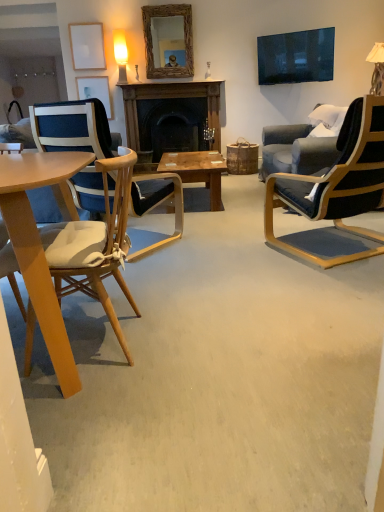
Where is `white fabric lampshade at upper right, the first lamp from the right`? white fabric lampshade at upper right, the first lamp from the right is located at coordinates (377, 68).

Locate an element on the screen. black leather chair at right, marked as the first chair in a right-to-left arrangement is located at coordinates (336, 192).

The image size is (384, 512). What do you see at coordinates (72, 127) in the screenshot?
I see `matte blue wood chair at left, arranged as the third chair when viewed from the right` at bounding box center [72, 127].

What is the approximate width of dark wood fireplace at center?

It is 8.84 inches.

The image size is (384, 512). What are the coordinates of `matte white picture frame at upper left, the second picture frame viewed from the top` in the screenshot? It's located at (95, 90).

How different are the orientations of dark wood fireplace at center and white matte picture frame at upper left, the first picture frame in the top-to-bottom sequence, in degrees?

There is a 0.0137-degree angle between the facing directions of dark wood fireplace at center and white matte picture frame at upper left, the first picture frame in the top-to-bottom sequence.

From the image's perspective, which is above, dark wood fireplace at center or white matte picture frame at upper left, the first picture frame in the top-to-bottom sequence?

white matte picture frame at upper left, the first picture frame in the top-to-bottom sequence, from the image's perspective.

Is dark wood fireplace at center far from white matte picture frame at upper left, the first picture frame in the top-to-bottom sequence?

That's right, there is a large distance between dark wood fireplace at center and white matte picture frame at upper left, the first picture frame in the top-to-bottom sequence.

Who is shorter, dark wood fireplace at center or white matte picture frame at upper left, the first picture frame in the top-to-bottom sequence?

white matte picture frame at upper left, the first picture frame in the top-to-bottom sequence, is shorter.

From the image's perspective, does dark wood fireplace at center appear lower than wooden coffee table at center?

No, from the image's perspective, dark wood fireplace at center is not beneath wooden coffee table at center.

From a real-world perspective, is dark wood fireplace at center positioned over wooden coffee table at center based on gravity?

Yes, from a real-world perspective, dark wood fireplace at center is on top of wooden coffee table at center.

Considering the points (209, 103) and (197, 167), which point is in front, point (209, 103) or point (197, 167)?

The point (197, 167) is closer to the camera.

Which object is positioned more to the right, dark wood fireplace at center or wooden coffee table at center?

From the viewer's perspective, wooden coffee table at center appears more on the right side.

From the picture: Can you confirm if white matte picture frame at upper left, which ranks as the 1th picture frame in front-to-back order, is thinner than white fabric lampshade at upper right, which is the second lamp from left to right?

Correct, the width of white matte picture frame at upper left, which ranks as the 1th picture frame in front-to-back order, is less than that of white fabric lampshade at upper right, which is the second lamp from left to right.

Is white matte picture frame at upper left, placed as the second picture frame when sorted from back to front, shorter than white fabric lampshade at upper right, the first lamp from the right?

Indeed, white matte picture frame at upper left, placed as the second picture frame when sorted from back to front, has a lesser height compared to white fabric lampshade at upper right, the first lamp from the right.

Would you consider white matte picture frame at upper left, which is the second picture frame from bottom to top, to be distant from white fabric lampshade at upper right, which is the second lamp from left to right?

Yes, white matte picture frame at upper left, which is the second picture frame from bottom to top, and white fabric lampshade at upper right, which is the second lamp from left to right, are located far from each other.

Between point (83, 53) and point (376, 80), which one is positioned behind?

Point (83, 53)

Between point (57, 118) and point (170, 23), which one is positioned behind?

The point (170, 23) is farther.

Considering the relative sizes of matte blue wood chair at left, the 1th chair positioned from the left, and woven wood mirror at upper center in the image provided, is matte blue wood chair at left, the 1th chair positioned from the left, shorter than woven wood mirror at upper center?

No, matte blue wood chair at left, the 1th chair positioned from the left, is not shorter than woven wood mirror at upper center.

Is matte blue wood chair at left, arranged as the third chair when viewed from the right, facing towards woven wood mirror at upper center?

No, matte blue wood chair at left, arranged as the third chair when viewed from the right, does not turn towards woven wood mirror at upper center.

Identify the location of the 2nd chair in front when counting from the dark wood fireplace at center. (336, 192).

Between black leather chair at right, marked as the first chair in a right-to-left arrangement, and dark wood fireplace at center, which one has more height?

black leather chair at right, marked as the first chair in a right-to-left arrangement, is taller.

Is black leather chair at right, marked as the first chair in a right-to-left arrangement, positioned before dark wood fireplace at center?

Yes, it is.

Is point (272, 196) less distant than point (126, 112)?

Yes, point (272, 196) is in front of point (126, 112).

Is white fabric lampshade at upper right, the first lamp from the right, facing away from light brown wood chair at left, which is counted as the 2th chair, starting from the right?

No, light brown wood chair at left, which is counted as the 2th chair, starting from the right, is not at the back of white fabric lampshade at upper right, the first lamp from the right.

How distant is white fabric lampshade at upper right, the first lamp from the right, from light brown wood chair at left, which appears as the 2th chair when viewed from the left?

white fabric lampshade at upper right, the first lamp from the right, and light brown wood chair at left, which appears as the 2th chair when viewed from the left, are 10.37 feet apart.

Is point (371, 51) positioned in front of point (110, 165)?

No, it is behind (110, 165).

Can you confirm if white fabric lampshade at upper right, which is the second lamp from left to right, is wider than light brown wood chair at left, which appears as the 2th chair when viewed from the left?

Incorrect, the width of white fabric lampshade at upper right, which is the second lamp from left to right, does not surpass that of light brown wood chair at left, which appears as the 2th chair when viewed from the left.

Who is more distant, matte white picture frame at upper left, the 2th picture frame when ordered from front to back, or dark wood fireplace at center?

matte white picture frame at upper left, the 2th picture frame when ordered from front to back, is behind.

In the scene shown: Considering the positions of objects matte white picture frame at upper left, the second picture frame viewed from the top, and dark wood fireplace at center in the image provided, who is more to the left, matte white picture frame at upper left, the second picture frame viewed from the top, or dark wood fireplace at center?

matte white picture frame at upper left, the second picture frame viewed from the top.

Are matte white picture frame at upper left, the second picture frame viewed from the top, and dark wood fireplace at center located far from each other?

No, matte white picture frame at upper left, the second picture frame viewed from the top, is in close proximity to dark wood fireplace at center.

Consider the image. Measure the distance between matte white picture frame at upper left, acting as the 1th picture frame starting from the bottom, and dark wood fireplace at center.

matte white picture frame at upper left, acting as the 1th picture frame starting from the bottom, and dark wood fireplace at center are 33.03 inches apart.

I want to click on picture frame that is the 2nd one above the dark wood fireplace at center (from a real-world perspective), so click(87, 46).

Where is `coffee table lying on the right of dark wood fireplace at center`? This screenshot has height=512, width=384. coffee table lying on the right of dark wood fireplace at center is located at coordinates (197, 170).

Estimate the real-world distances between objects in this image. Which object is closer to dark wood fireplace at center, black leather chair at right, acting as the third chair starting from the left, or matte white picture frame at upper left, the 2th picture frame when ordered from front to back?

matte white picture frame at upper left, the 2th picture frame when ordered from front to back, is closer to dark wood fireplace at center.

Which object lies nearer to the anchor point matte blue wood chair at left, arranged as the third chair when viewed from the right, black leather chair at right, marked as the first chair in a right-to-left arrangement, or matte yellow glass lamp at upper center, positioned as the 1th lamp in left-to-right order?

black leather chair at right, marked as the first chair in a right-to-left arrangement, lies closer to matte blue wood chair at left, arranged as the third chair when viewed from the right, than the other object.

Considering their positions, is white matte picture frame at upper left, which is the second picture frame from bottom to top, positioned further to light brown wood chair at left, which is counted as the 2th chair, starting from the right, than black leather chair at right, marked as the first chair in a right-to-left arrangement?

Based on the image, white matte picture frame at upper left, which is the second picture frame from bottom to top, appears to be further to light brown wood chair at left, which is counted as the 2th chair, starting from the right.

Looking at the image, which one is located further to white matte picture frame at upper left, which is the second picture frame from bottom to top, matte white picture frame at upper left, the 2th picture frame when ordered from front to back, or matte blue wood chair at left, arranged as the third chair when viewed from the right?

matte blue wood chair at left, arranged as the third chair when viewed from the right, is further to white matte picture frame at upper left, which is the second picture frame from bottom to top.

Consider the image. Looking at the image, which one is located closer to white fabric lampshade at upper right, which is the second lamp from left to right, matte yellow glass lamp at upper center, which appears as the second lamp when viewed from the right, or light brown wood chair at left, which is counted as the 2th chair, starting from the right?

The object closer to white fabric lampshade at upper right, which is the second lamp from left to right, is matte yellow glass lamp at upper center, which appears as the second lamp when viewed from the right.

Estimate the real-world distances between objects in this image. Which object is further from black leather chair at right, marked as the first chair in a right-to-left arrangement, matte yellow glass lamp at upper center, which appears as the second lamp when viewed from the right, or wooden coffee table at center?

matte yellow glass lamp at upper center, which appears as the second lamp when viewed from the right, is further to black leather chair at right, marked as the first chair in a right-to-left arrangement.

Estimate the real-world distances between objects in this image. Which object is further from matte white picture frame at upper left, acting as the 1th picture frame starting from the bottom, matte blue wood chair at left, the 1th chair positioned from the left, or black leather chair at right, acting as the third chair starting from the left?

The object further to matte white picture frame at upper left, acting as the 1th picture frame starting from the bottom, is black leather chair at right, acting as the third chair starting from the left.

When comparing their distances from white matte picture frame at upper left, the first picture frame in the top-to-bottom sequence, does white fabric lampshade at upper right, which is the second lamp from left to right, or matte blue wood chair at left, the 1th chair positioned from the left, seem further?

white fabric lampshade at upper right, which is the second lamp from left to right, is further to white matte picture frame at upper left, the first picture frame in the top-to-bottom sequence.

Identify the location of mirror between light brown wood chair at left, which is counted as the 2th chair, starting from the right, and matte yellow glass lamp at upper center, positioned as the 1th lamp in left-to-right order, in the front-back direction. Image resolution: width=384 pixels, height=512 pixels. (168, 41).

Where is `chair located between black leather chair at right, marked as the first chair in a right-to-left arrangement, and white matte picture frame at upper left, which is the second picture frame from bottom to top, in the depth direction`? This screenshot has width=384, height=512. chair located between black leather chair at right, marked as the first chair in a right-to-left arrangement, and white matte picture frame at upper left, which is the second picture frame from bottom to top, in the depth direction is located at coordinates (72, 127).

At what (x,y) coordinates should I click in order to perform the action: click on chair positioned between black leather chair at right, marked as the first chair in a right-to-left arrangement, and matte white picture frame at upper left, the 2th picture frame when ordered from front to back, from near to far. Please return your answer as a coordinate pair (x, y). The height and width of the screenshot is (512, 384). Looking at the image, I should click on (72, 127).

The image size is (384, 512). Find the location of `picture frame positioned between light brown wood chair at left, which appears as the 2th chair when viewed from the left, and dark wood fireplace at center from near to far`. picture frame positioned between light brown wood chair at left, which appears as the 2th chair when viewed from the left, and dark wood fireplace at center from near to far is located at coordinates (87, 46).